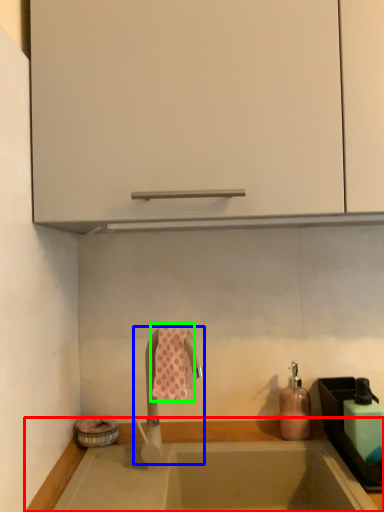
Question: Estimate the real-world distances between objects in this image. Which object is closer to countertop (highlighted by a red box), tap (highlighted by a blue box) or beach towel (highlighted by a green box)?

Choices:
 (A) tap
 (B) beach towel

Answer: (A)